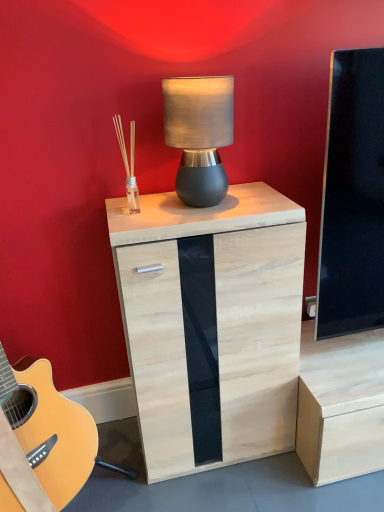
I want to click on free space in front of light wood/glass cabinet at center, so click(233, 490).